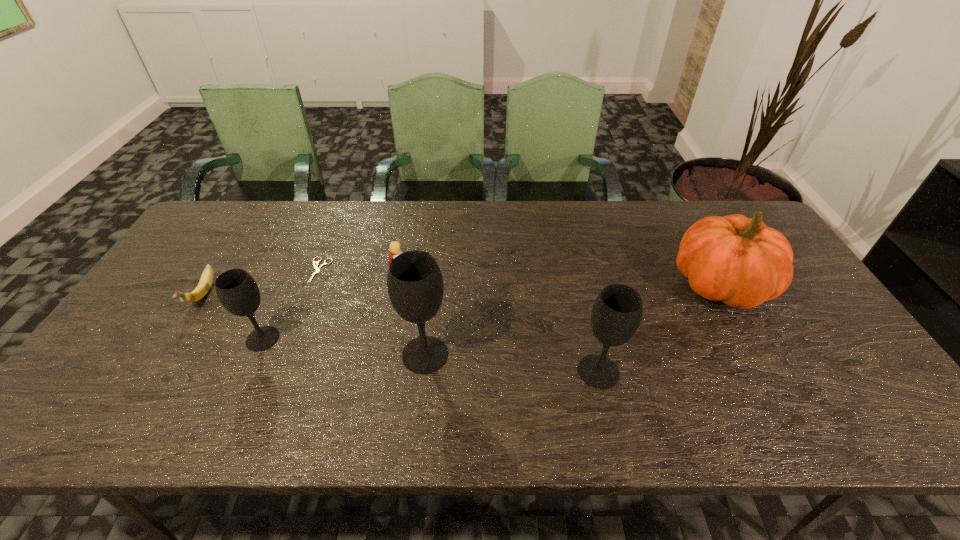
Image resolution: width=960 pixels, height=540 pixels. In order to click on free region that satisfies the following two spatial constraints: 1. on the front-facing side of the third shortest object; 2. on the back side of the fifth object from left to right in this screenshot , I will do `click(386, 354)`.

Image resolution: width=960 pixels, height=540 pixels. In order to click on free space that satisfies the following two spatial constraints: 1. on the front-facing side of the Lego; 2. at the stem of the leftmost object in this screenshot , I will do `click(396, 296)`.

At what (x,y) coordinates should I click in order to perform the action: click on free region that satisfies the following two spatial constraints: 1. on the front-facing side of the fourth object from left to right; 2. on the right side of the third object from right to left. Please return your answer as a coordinate pair (x, y). The height and width of the screenshot is (540, 960). Looking at the image, I should click on (386, 354).

Locate an element on the screen. The height and width of the screenshot is (540, 960). free spot that satisfies the following two spatial constraints: 1. on the front side of the third object from left to right; 2. on the right side of the rightmost object is located at coordinates (314, 286).

Find the location of a particular element. This screenshot has width=960, height=540. vacant region that satisfies the following two spatial constraints: 1. on the back side of the fourth shortest object; 2. on the left side of the shortest object is located at coordinates (293, 271).